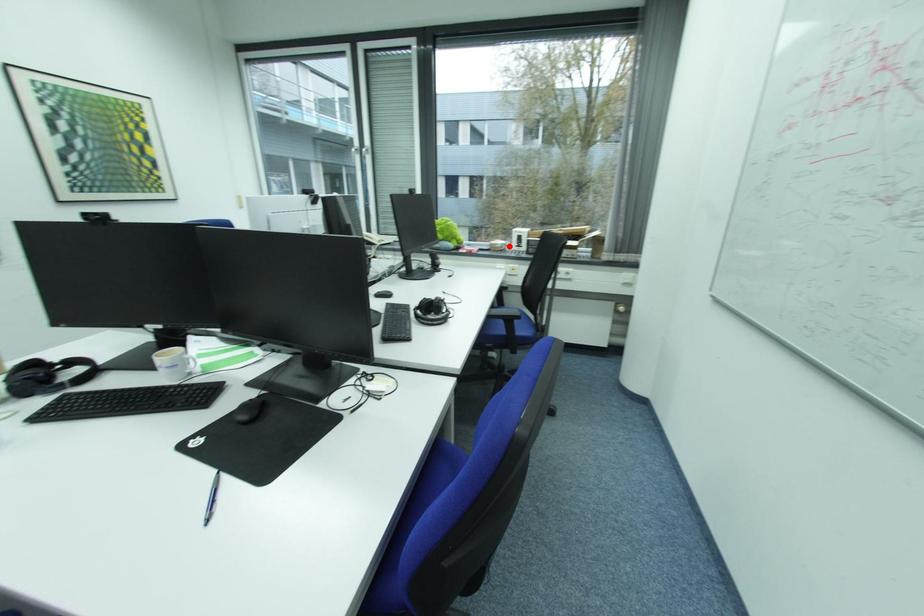
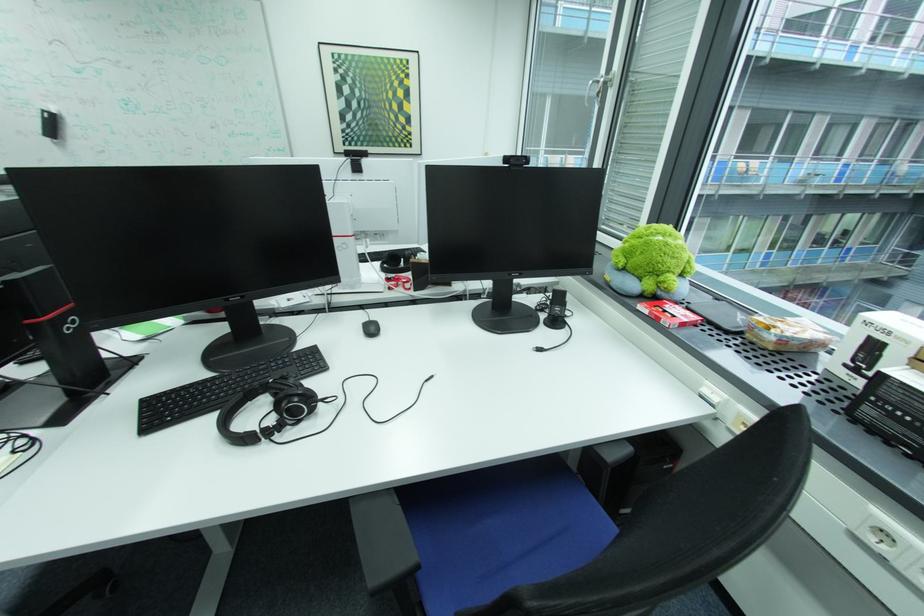
Question: I am providing you with two images of the same scene from different viewpoints. A red point is marked on the first image. Is the red point's position out of view in image 2?

Choices:
 (A) Yes
 (B) No

Answer: (B)